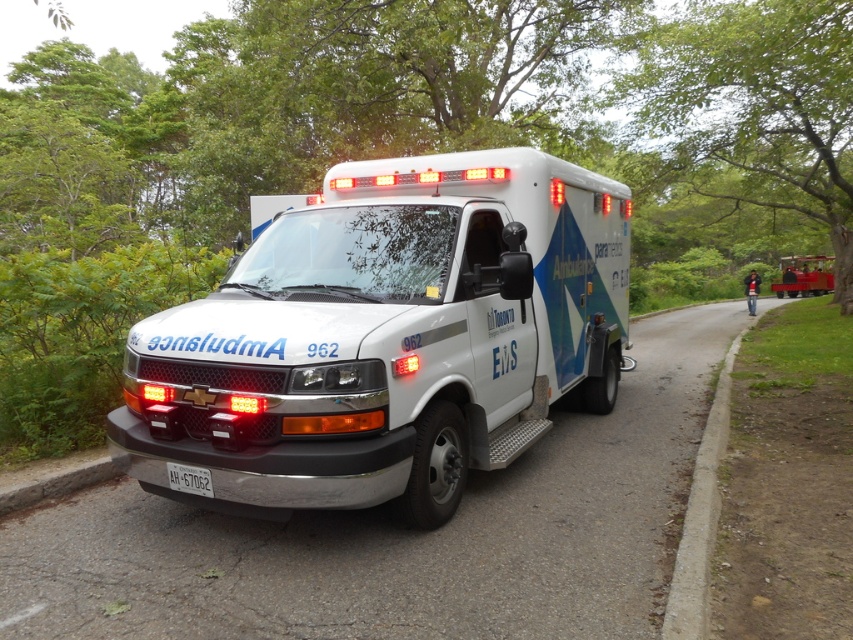
Question: Among these points, which one is farthest from the camera?

Choices:
 (A) (827, 269)
 (B) (474, 422)
 (C) (181, 465)

Answer: (A)

Question: Estimate the real-world distances between objects in this image. Which object is farther from the white plastic license plate at lower center?

Choices:
 (A) white glossy ambulance at center
 (B) red rubber trolley at right

Answer: (B)

Question: Does white glossy ambulance at center appear over white plastic license plate at lower center?

Choices:
 (A) no
 (B) yes

Answer: (B)

Question: Does red rubber trolley at right appear under white plastic license plate at lower center?

Choices:
 (A) no
 (B) yes

Answer: (A)

Question: Which is farther from the white glossy ambulance at center?

Choices:
 (A) white plastic license plate at lower center
 (B) red rubber trolley at right

Answer: (B)

Question: From the image, what is the correct spatial relationship of white glossy ambulance at center in relation to red rubber trolley at right?

Choices:
 (A) right
 (B) left

Answer: (B)